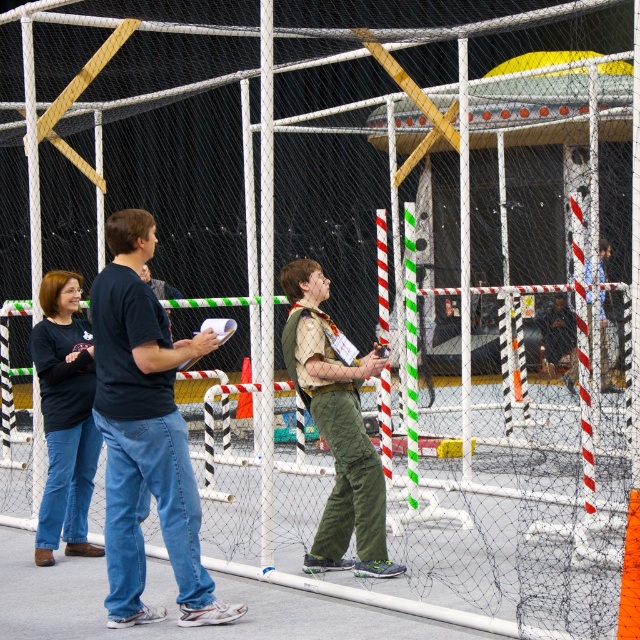
Question: Among these points, which one is farthest from the camera?

Choices:
 (A) [x=49, y=272]
 (B) [x=195, y=532]
 (C) [x=314, y=372]

Answer: (A)

Question: Which object is positioned farthest from the dark blue shirt at center?

Choices:
 (A) khaki uniform at center
 (B) matte black shirt at left

Answer: (B)

Question: From the image, what is the correct spatial relationship of dark blue shirt at center in relation to khaki uniform at center?

Choices:
 (A) left
 (B) right

Answer: (A)

Question: Observing the image, what is the correct spatial positioning of dark blue shirt at center in reference to khaki uniform at center?

Choices:
 (A) above
 (B) below

Answer: (A)

Question: Among these points, which one is nearest to the camera?

Choices:
 (A) (394, 568)
 (B) (116, 428)
 (C) (90, 449)

Answer: (B)

Question: Is dark blue shirt at center in front of matte black shirt at left?

Choices:
 (A) no
 (B) yes

Answer: (B)